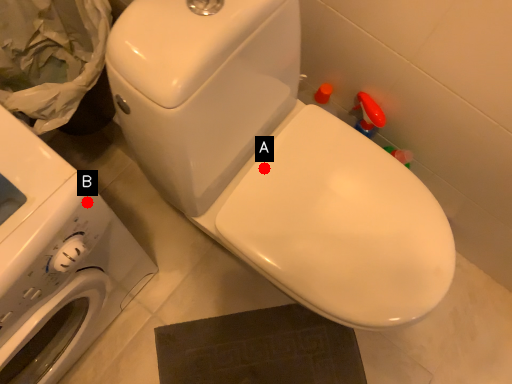
Question: Two points are circled on the image, labeled by A and B beside each circle. Among these points, which one is nearest to the camera?

Choices:
 (A) A is closer
 (B) B is closer

Answer: (B)